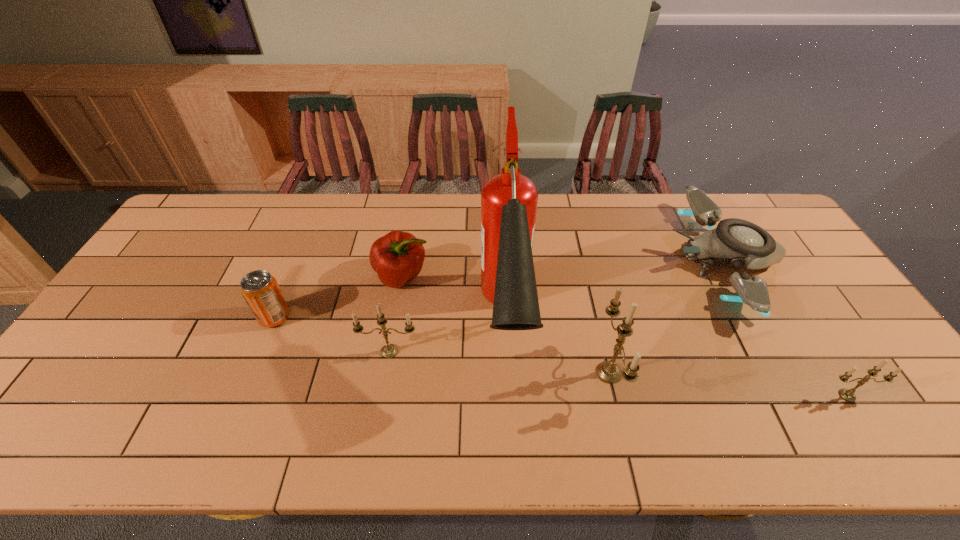
The image size is (960, 540). Find the location of `vacant area situated on the left of the second shortest candle`. vacant area situated on the left of the second shortest candle is located at coordinates (299, 352).

Locate an element on the screen. The width and height of the screenshot is (960, 540). vacant area located 0.280m on the back of the second tallest object is located at coordinates (584, 264).

At what (x,y) coordinates should I click in order to perform the action: click on vacant space located 0.380m on the back of the shortest candle. Please return your answer as a coordinate pair (x, y). Looking at the image, I should click on point(771,276).

Identify the location of vacant space located on the front-facing side of the shortest object. (647, 260).

Where is `free space located 0.070m on the front-facing side of the shortest object`? free space located 0.070m on the front-facing side of the shortest object is located at coordinates (647, 260).

Where is `free space located 0.280m on the front-facing side of the shortest object`? free space located 0.280m on the front-facing side of the shortest object is located at coordinates (580, 260).

Identify the location of vacant area situated 0.170m on the front of the leftmost object. (247, 386).

Where is `free space located on the back of the bell pepper`? The width and height of the screenshot is (960, 540). free space located on the back of the bell pepper is located at coordinates (415, 201).

Where is `object at the far edge`? object at the far edge is located at coordinates (737, 242).

Where is `fire extinguisher positioned at the near edge`? This screenshot has width=960, height=540. fire extinguisher positioned at the near edge is located at coordinates (509, 200).